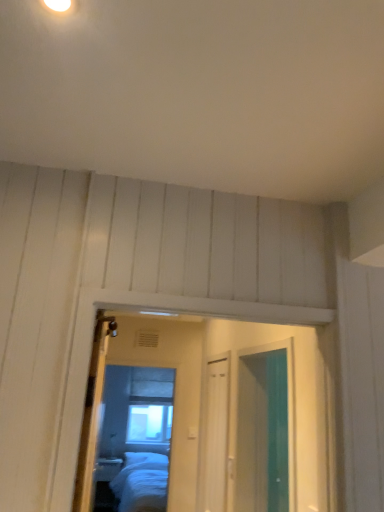
Question: From a real-world perspective, is wooden door at center above or below matte glass mirror at center?

Choices:
 (A) below
 (B) above

Answer: (B)

Question: From the image's perspective, is wooden door at center positioned above or below matte glass mirror at center?

Choices:
 (A) below
 (B) above

Answer: (B)

Question: Considering the real-world distances, which object is closest to the matte glass mirror at center?

Choices:
 (A) wooden door at center
 (B) clear glass window at center

Answer: (B)

Question: Estimate the real-world distances between objects in this image. Which object is closer to the wooden door at center?

Choices:
 (A) matte glass mirror at center
 (B) clear glass window at center

Answer: (A)